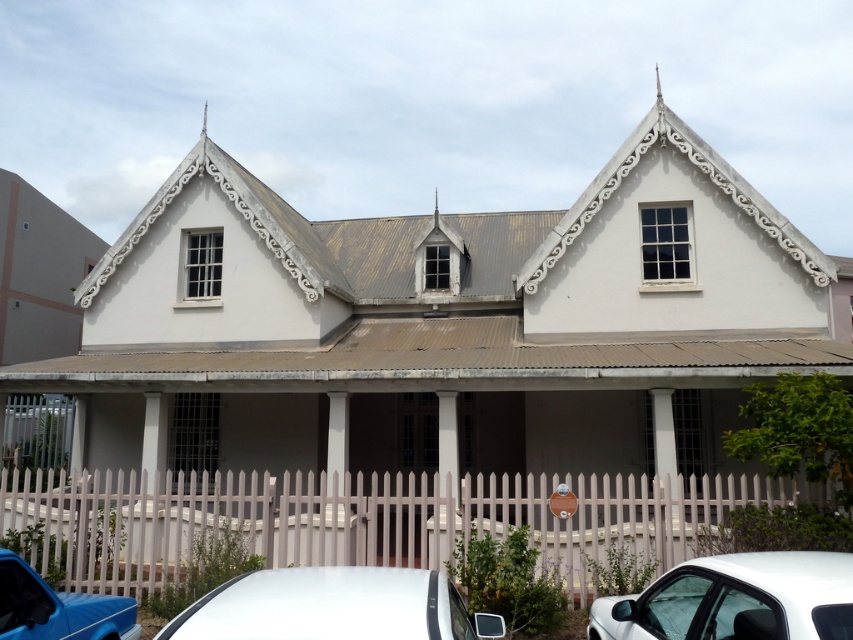
Question: Is white picket fence at lower center above matte blue car at lower left?

Choices:
 (A) yes
 (B) no

Answer: (B)

Question: Can you confirm if white picket fence at lower center is bigger than matte blue car at lower left?

Choices:
 (A) yes
 (B) no

Answer: (A)

Question: Which object is positioned closest to the white glossy car at lower right?

Choices:
 (A) matte blue car at lower left
 (B) white picket fence at lower center

Answer: (A)

Question: Which object is positioned farthest from the matte blue car at lower left?

Choices:
 (A) white picket fence at lower center
 (B) white glossy car at lower right

Answer: (A)

Question: Based on their relative distances, which object is farther from the white picket fence at lower center?

Choices:
 (A) matte blue car at lower left
 (B) white matte car at lower center
 (C) white glossy car at lower right

Answer: (B)

Question: Is white picket fence at lower center to the left of matte blue car at lower left from the viewer's perspective?

Choices:
 (A) no
 (B) yes

Answer: (A)